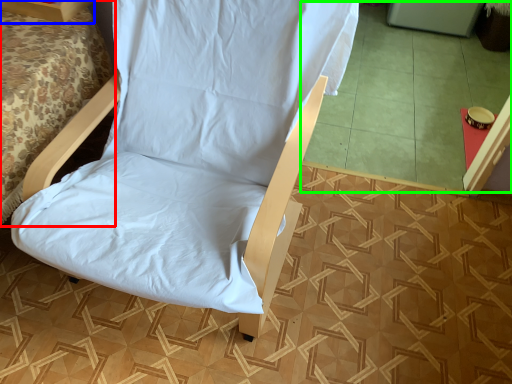
Question: Which is farther away from bed (highlighted by a red box)? furniture (highlighted by a blue box) or tile (highlighted by a green box)?

Choices:
 (A) furniture
 (B) tile

Answer: (B)